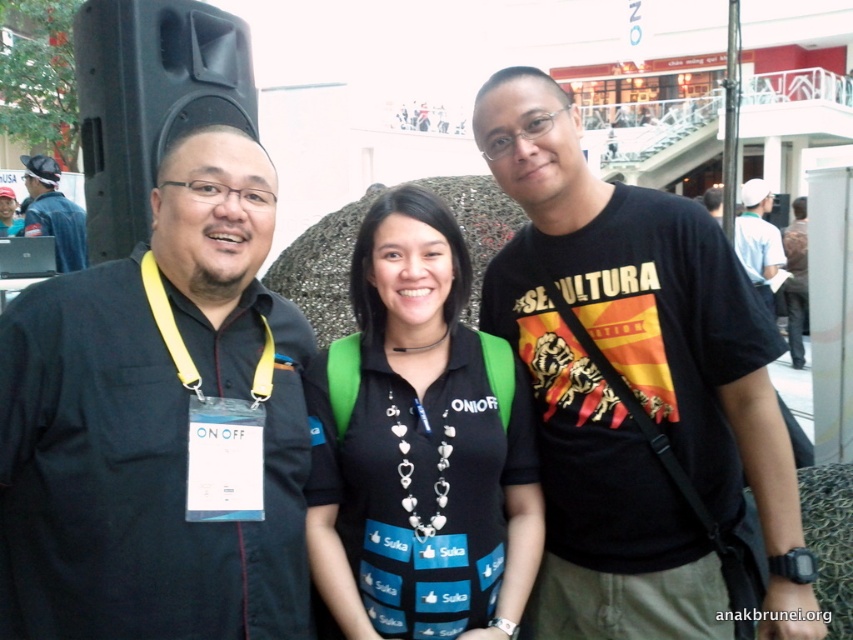
Question: Is black cotton t-shirt at center bigger than yellow fabric lanyard at center?

Choices:
 (A) no
 (B) yes

Answer: (B)

Question: Does black matte shirt at center appear over white matte cap at upper right?

Choices:
 (A) no
 (B) yes

Answer: (A)

Question: Which point is closer to the camera?

Choices:
 (A) (738, 234)
 (B) (593, 516)

Answer: (B)

Question: Which point is farther from the camera taking this photo?

Choices:
 (A) (601, 612)
 (B) (368, 611)
 (C) (32, 225)
 (D) (239, 321)

Answer: (C)

Question: Considering the real-world distances, which object is farthest from the dark blue shirt at left?

Choices:
 (A) yellow fabric lanyard at center
 (B) black matte shirt at left

Answer: (A)

Question: Can you confirm if black cotton t-shirt at center is smaller than black matte shirt at center?

Choices:
 (A) yes
 (B) no

Answer: (B)